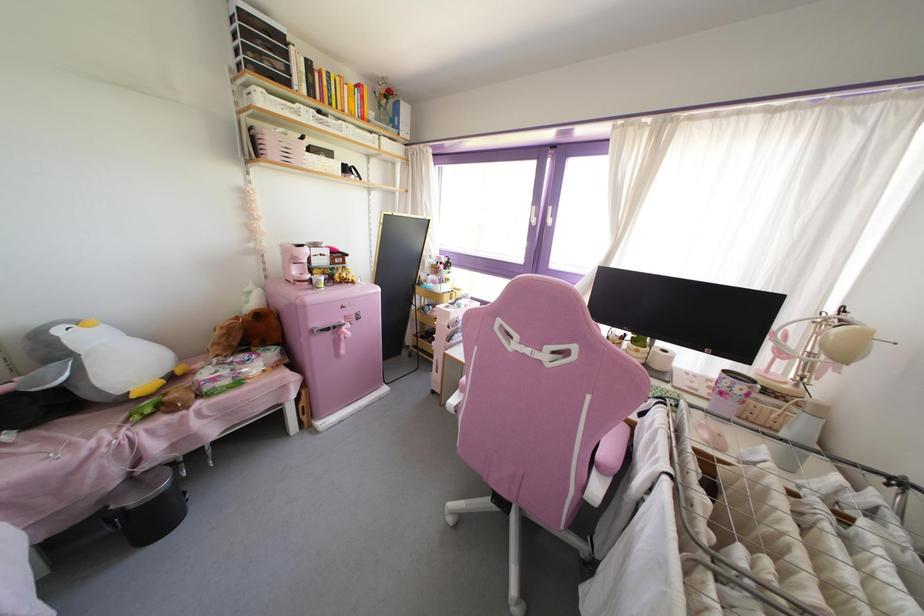
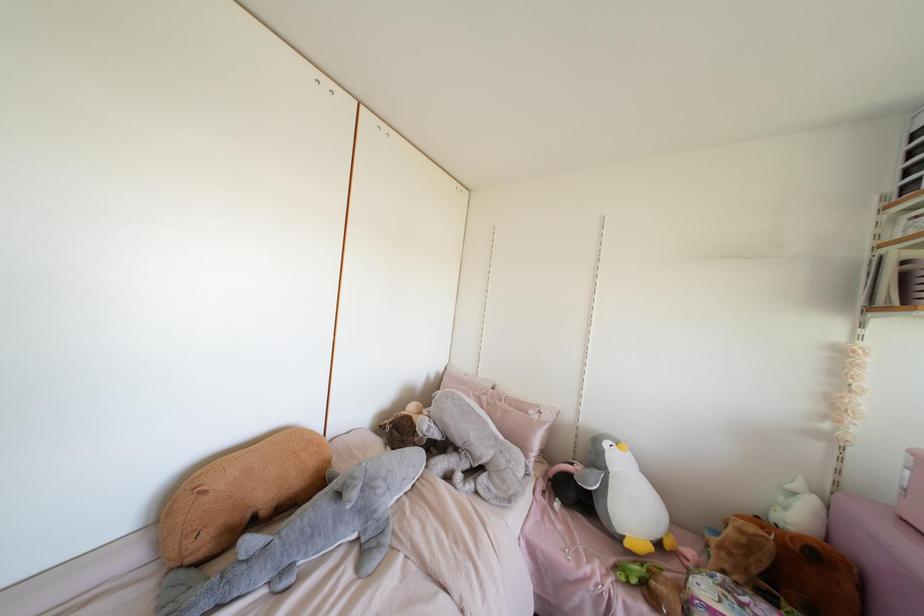
Find the pixel in the second image that matches pixel 222 328 in the first image.

(739, 531)